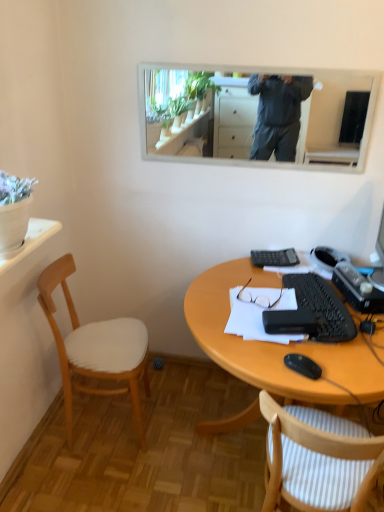
Question: Is white striped fabric chair at lower right, marked as the second chair in a left-to-right arrangement, at the right side of wooden desk at lower center?

Choices:
 (A) no
 (B) yes

Answer: (A)

Question: Is white striped fabric chair at lower right, which is the 1th chair from right to left, positioned behind wooden desk at lower center?

Choices:
 (A) yes
 (B) no

Answer: (B)

Question: Is white striped fabric chair at lower right, marked as the second chair in a left-to-right arrangement, surrounding wooden desk at lower center?

Choices:
 (A) no
 (B) yes

Answer: (A)

Question: Is white striped fabric chair at lower right, which is the 1th chair from right to left, facing away from wooden desk at lower center?

Choices:
 (A) no
 (B) yes

Answer: (B)

Question: Is white striped fabric chair at lower right, marked as the second chair in a left-to-right arrangement, to the left of wooden desk at lower center from the viewer's perspective?

Choices:
 (A) yes
 (B) no

Answer: (A)

Question: From the image's perspective, is white framed mirror at upper center located above or below wooden desk at lower center?

Choices:
 (A) below
 (B) above

Answer: (B)

Question: Considering the positions of white framed mirror at upper center and wooden desk at lower center in the image, is white framed mirror at upper center wider or thinner than wooden desk at lower center?

Choices:
 (A) wide
 (B) thin

Answer: (B)

Question: In terms of size, does white framed mirror at upper center appear bigger or smaller than wooden desk at lower center?

Choices:
 (A) small
 (B) big

Answer: (A)

Question: Is point (238, 100) closer or farther from the camera than point (221, 310)?

Choices:
 (A) farther
 (B) closer

Answer: (A)

Question: From their relative heights in the image, would you say white striped fabric chair at lower right, marked as the second chair in a left-to-right arrangement, is taller or shorter than black plastic mouse at lower right?

Choices:
 (A) short
 (B) tall

Answer: (B)

Question: Considering the relative positions of white striped fabric chair at lower right, marked as the second chair in a left-to-right arrangement, and black plastic mouse at lower right in the image provided, is white striped fabric chair at lower right, marked as the second chair in a left-to-right arrangement, to the left or to the right of black plastic mouse at lower right?

Choices:
 (A) left
 (B) right

Answer: (B)

Question: From the image's perspective, is white striped fabric chair at lower right, which is the 1th chair from right to left, positioned above or below black plastic mouse at lower right?

Choices:
 (A) below
 (B) above

Answer: (A)

Question: Is white striped fabric chair at lower right, marked as the second chair in a left-to-right arrangement, inside the boundaries of black plastic mouse at lower right, or outside?

Choices:
 (A) outside
 (B) inside

Answer: (A)

Question: From the image's perspective, is wooden desk at lower center positioned above or below white paper at center?

Choices:
 (A) above
 (B) below

Answer: (B)

Question: Is wooden desk at lower center taller or shorter than white paper at center?

Choices:
 (A) short
 (B) tall

Answer: (B)